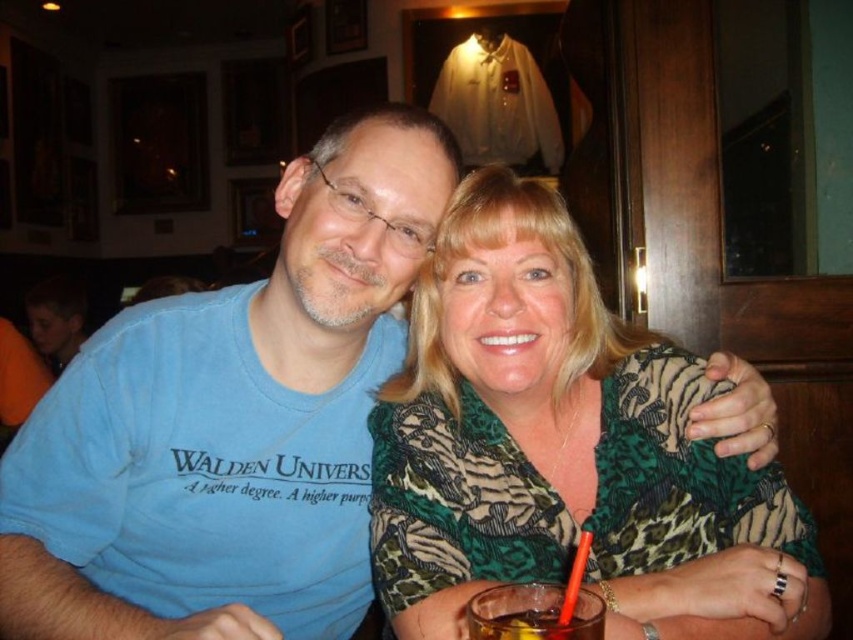
Question: Which point is farther to the camera?

Choices:
 (A) (538, 592)
 (B) (589, 540)
 (C) (486, 628)

Answer: (A)

Question: Does translucent glass at lower center have a lesser width compared to dark amber liquid at lower center?

Choices:
 (A) yes
 (B) no

Answer: (B)

Question: Which point is closer to the camera taking this photo?

Choices:
 (A) (410, 531)
 (B) (584, 560)
 (C) (529, 632)

Answer: (C)

Question: Can you confirm if translucent glass at lower center is positioned below orange plastic straw at lower center?

Choices:
 (A) yes
 (B) no

Answer: (A)

Question: Where is green leopard print blouse at center located in relation to orange plastic straw at lower center in the image?

Choices:
 (A) below
 (B) above

Answer: (B)

Question: Which point is closer to the camera?

Choices:
 (A) dark amber liquid at lower center
 (B) orange plastic straw at lower center

Answer: (A)